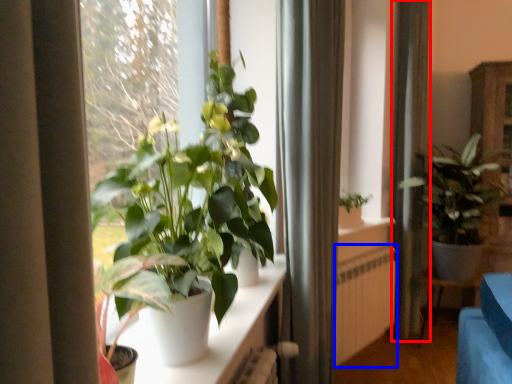
Question: Which object appears farthest to the camera in this image, curtain (highlighted by a red box) or radiator (highlighted by a blue box)?

Choices:
 (A) curtain
 (B) radiator

Answer: (A)